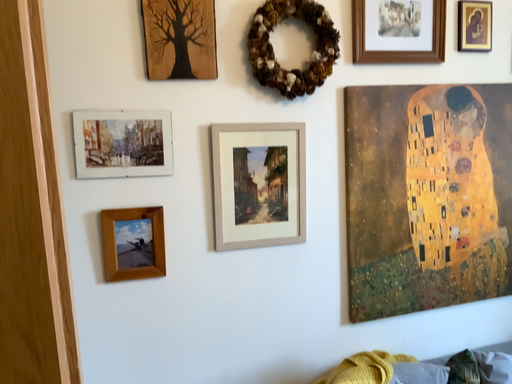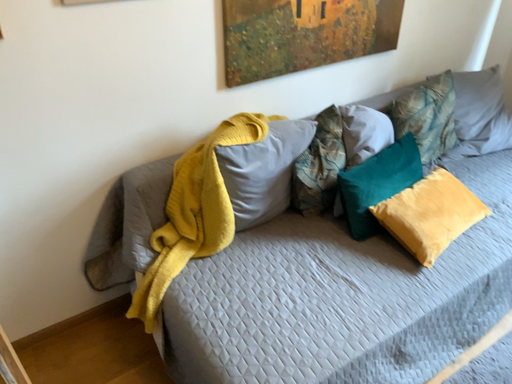
Question: How did the camera likely rotate when shooting the video?

Choices:
 (A) rotated left
 (B) rotated right

Answer: (B)